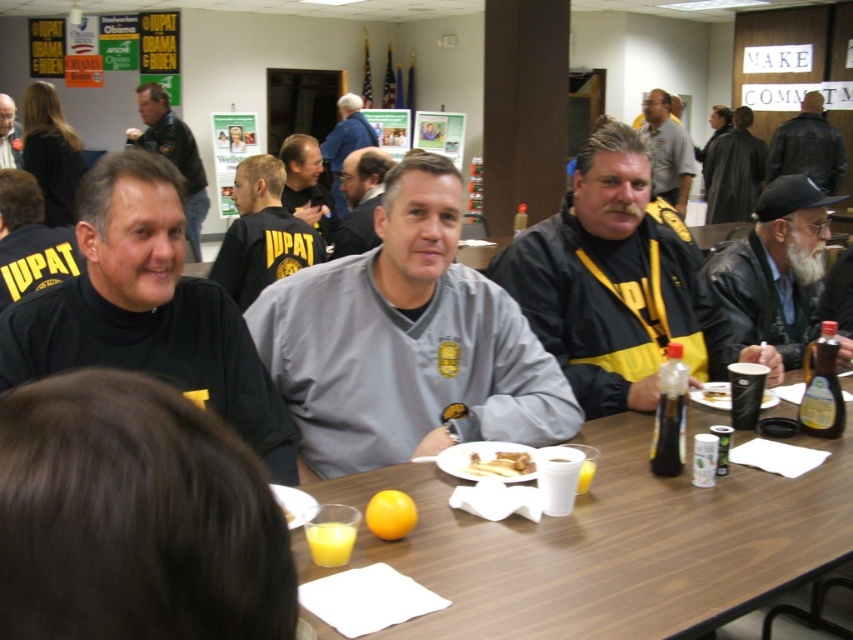
You are a photographer trying to capture a group photo of the gray fabric shirt at center and the gray fleece sweater at center. Which one should you focus on to ensure their full height is visible in the photo?

The gray fabric shirt at center is much taller than the gray fleece sweater at center, so focusing on the gray fabric shirt at center will ensure both their full heights are visible in the photo.

You are at a social gathering and want to greet two people wearing gray tops. The first person is wearing a gray fabric shirt at center, and the second is wearing a gray fleece sweater at center. If you approach from the left side of the table, which person should you greet first?

You should greet the gray fleece sweater at center first because the gray fabric shirt at center is to the right of the gray fleece sweater at center, so the fleece sweater is closer to your left side approach.

In the image of the group at the wooden table, there is a point located at coordinates (405, 342). Which object from the following list is this point located on? The objects are the black turtleneck under the jacket on the left, the gray fabric shirt at center, and the black attire on the right.

The point at coordinates (405, 342) is located on the gray fabric shirt at center.